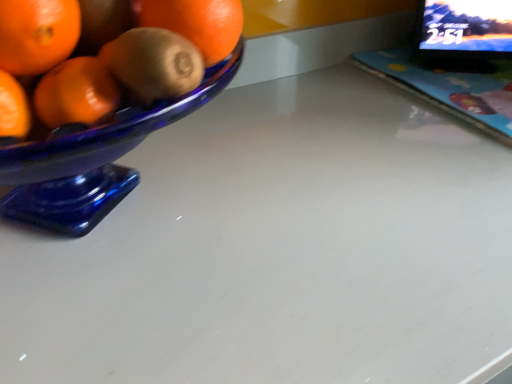
Question: Based on their sizes in the image, would you say black glossy computer monitor at upper right is bigger or smaller than matte plastic laptop at upper right?

Choices:
 (A) small
 (B) big

Answer: (B)

Question: Is black glossy computer monitor at upper right wider or thinner than matte plastic laptop at upper right?

Choices:
 (A) wide
 (B) thin

Answer: (B)

Question: Would you say black glossy computer monitor at upper right is to the left or to the right of matte plastic laptop at upper right in the picture?

Choices:
 (A) right
 (B) left

Answer: (B)

Question: Visually, is matte plastic laptop at upper right positioned to the left or to the right of black glossy computer monitor at upper right?

Choices:
 (A) left
 (B) right

Answer: (B)

Question: From a real-world perspective, is matte plastic laptop at upper right above or below black glossy computer monitor at upper right?

Choices:
 (A) below
 (B) above

Answer: (A)

Question: Considering the positions of matte plastic laptop at upper right and black glossy computer monitor at upper right in the image, is matte plastic laptop at upper right taller or shorter than black glossy computer monitor at upper right?

Choices:
 (A) tall
 (B) short

Answer: (B)

Question: Looking at their shapes, would you say matte plastic laptop at upper right is wider or thinner than black glossy computer monitor at upper right?

Choices:
 (A) thin
 (B) wide

Answer: (B)